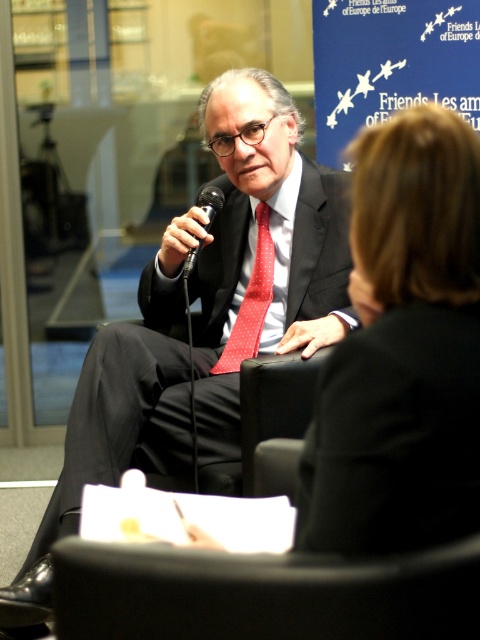
Question: Is black leather jacket at upper right bigger than black leather chair at lower center?

Choices:
 (A) no
 (B) yes

Answer: (B)

Question: Which point is farther to the camera?

Choices:
 (A) (238, 108)
 (B) (355, 214)

Answer: (A)

Question: Is black leather jacket at upper right positioned at the back of red dotted fabric tie at center?

Choices:
 (A) no
 (B) yes

Answer: (A)

Question: Based on their relative distances, which object is nearer to the matte black suit at center?

Choices:
 (A) black metallic microphone at center
 (B) black leather jacket at upper right
 (C) red dotted fabric tie at center
 (D) black leather chair at lower center

Answer: (C)

Question: Which object is farther from the camera taking this photo?

Choices:
 (A) matte black suit at center
 (B) black leather chair at lower center
 (C) red dotted fabric tie at center

Answer: (C)

Question: Can you confirm if matte black suit at center is smaller than red dotted fabric tie at center?

Choices:
 (A) yes
 (B) no

Answer: (B)